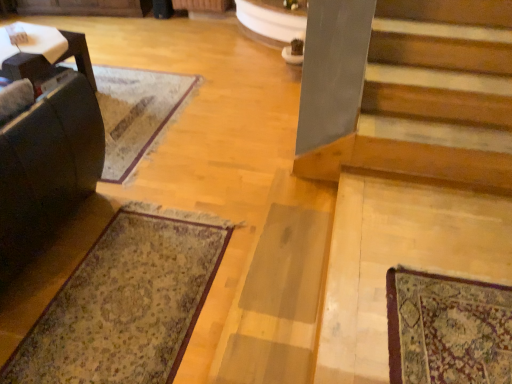
Question: Is wooden stairs at lower right thinner than dark brown leather rocking chair at left?

Choices:
 (A) no
 (B) yes

Answer: (B)

Question: Is wooden stairs at lower right wider than dark brown leather rocking chair at left?

Choices:
 (A) yes
 (B) no

Answer: (B)

Question: Would you say wooden stairs at lower right is outside dark brown leather rocking chair at left?

Choices:
 (A) yes
 (B) no

Answer: (A)

Question: Is wooden stairs at lower right positioned far away from dark brown leather rocking chair at left?

Choices:
 (A) yes
 (B) no

Answer: (A)

Question: From a real-world perspective, is wooden stairs at lower right positioned over dark brown leather rocking chair at left based on gravity?

Choices:
 (A) no
 (B) yes

Answer: (A)

Question: Considering the relative sizes of wooden stairs at lower right and dark brown leather rocking chair at left in the image provided, is wooden stairs at lower right taller than dark brown leather rocking chair at left?

Choices:
 (A) yes
 (B) no

Answer: (B)

Question: Could you tell me if dark brown leather rocking chair at left is facing wooden stairs at lower right?

Choices:
 (A) yes
 (B) no

Answer: (B)

Question: Considering the relative sizes of dark brown leather rocking chair at left and wooden stairs at lower right in the image provided, is dark brown leather rocking chair at left smaller than wooden stairs at lower right?

Choices:
 (A) no
 (B) yes

Answer: (A)

Question: Is dark brown leather rocking chair at left turned away from wooden stairs at lower right?

Choices:
 (A) yes
 (B) no

Answer: (B)

Question: Is dark brown leather rocking chair at left further to camera compared to wooden stairs at lower right?

Choices:
 (A) no
 (B) yes

Answer: (B)

Question: Is dark brown leather rocking chair at left closer to camera compared to wooden stairs at lower right?

Choices:
 (A) yes
 (B) no

Answer: (B)

Question: From the image's perspective, is dark brown leather rocking chair at left on top of wooden stairs at lower right?

Choices:
 (A) no
 (B) yes

Answer: (B)

Question: Does dark brown leather rocking chair at left touch patterned carpet at lower left?

Choices:
 (A) no
 (B) yes

Answer: (A)